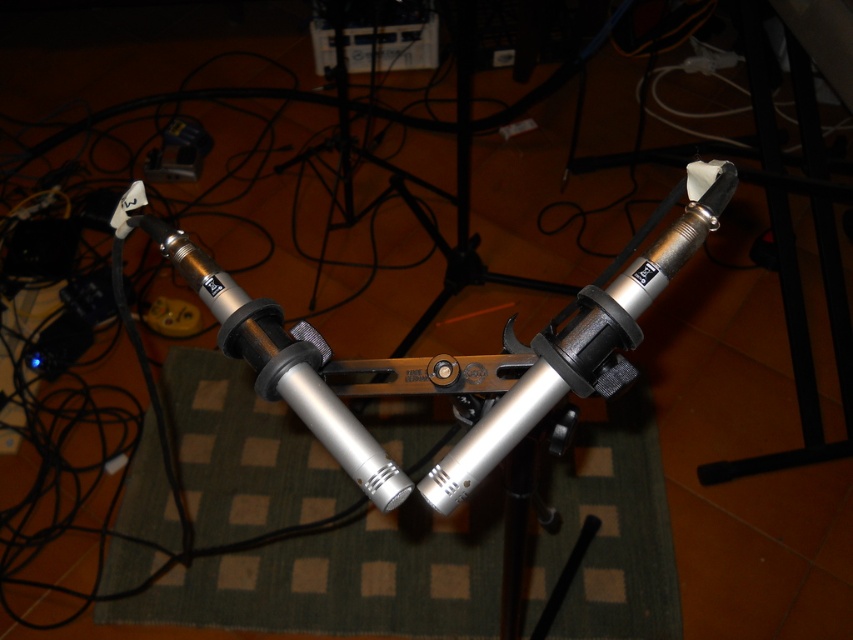
From the picture: Does green woven mat at center appear under silver metallic tripod at center?

Indeed, green woven mat at center is positioned under silver metallic tripod at center.

Is point (282, 509) closer to camera compared to point (343, 188)?

Yes, it is in front of point (343, 188).

Between point (300, 499) and point (431, 188), which one is positioned behind?

The point (431, 188) is behind.

At what (x,y) coordinates should I click in order to perform the action: click on green woven mat at center. Please return your answer as a coordinate pair (x, y). This screenshot has width=853, height=640. Looking at the image, I should click on (347, 579).